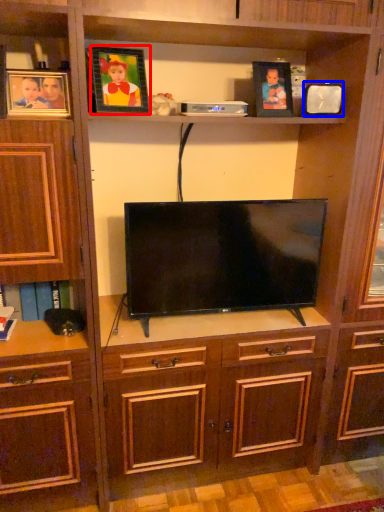
Question: Which object appears closest to the camera in this image, picture frame (highlighted by a red box) or picture frame (highlighted by a blue box)?

Choices:
 (A) picture frame
 (B) picture frame

Answer: (A)